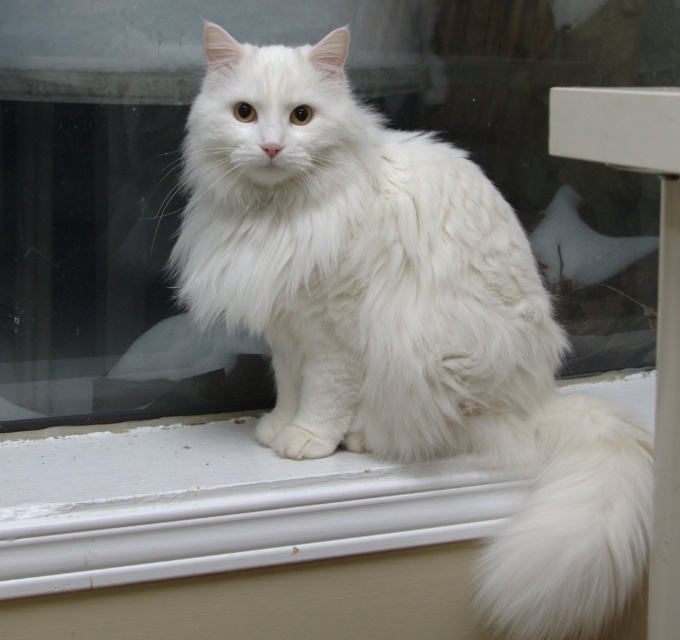
You are a photographer trying to capture the white fluffy cat at center and the white fluffy tail at lower right in a single shot. Since the camera can only focus on one subject at a time, which subject should you focus on to ensure it appears larger in the photo?

The white fluffy cat at center is taller than the white fluffy tail at lower right, so focusing on the white fluffy cat at center will ensure it appears larger in the photo.

You are a photographer trying to capture the white fluffy cat at center and the white fluffy tail at lower right in a single shot. Based on their positions, can you tell if the tail is part of the cat or a separate object?

The white fluffy cat at center is located above the white fluffy tail at lower right, so the tail is part of the cat.